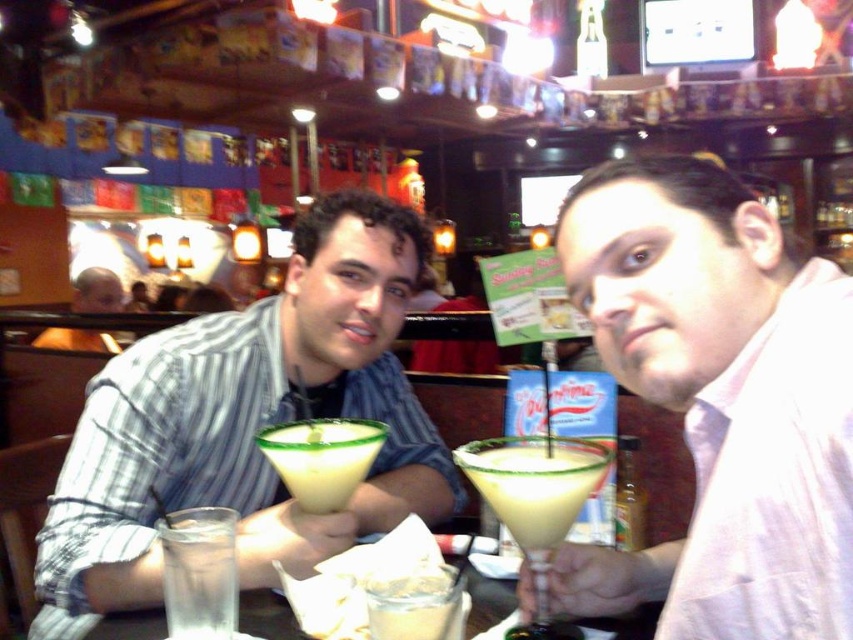
Can you confirm if matte green glass at center is wider than yellowish-green liquid at center?

Yes.

Who is higher up, matte green glass at center or yellowish-green liquid at center?

yellowish-green liquid at center is above.

Between point (392, 218) and point (364, 424), which one is positioned behind?

The point (392, 218) is more distant.

Locate an element on the screen. Image resolution: width=853 pixels, height=640 pixels. matte green glass at center is located at coordinates (247, 422).

Who is more forward, (514, 502) or (90, 636)?

Point (514, 502) is in front.

Which is below, translucent glass martini at center or clear glass at lower center?

clear glass at lower center is below.

Find the location of a particular element. The width and height of the screenshot is (853, 640). translucent glass martini at center is located at coordinates (535, 502).

At what (x,y) coordinates should I click in order to perform the action: click on translucent glass martini at center. Please return your answer as a coordinate pair (x, y). This screenshot has width=853, height=640. Looking at the image, I should click on (535, 502).

Who is shorter, yellowish-green liquid at center or clear glass at lower center?

clear glass at lower center is shorter.

Does yellowish-green liquid at center have a larger size compared to clear glass at lower center?

No, yellowish-green liquid at center is not bigger than clear glass at lower center.

Is point (381, 433) less distant than point (287, 621)?

No, it is behind (287, 621).

Locate an element on the screen. The width and height of the screenshot is (853, 640). yellowish-green liquid at center is located at coordinates (322, 458).